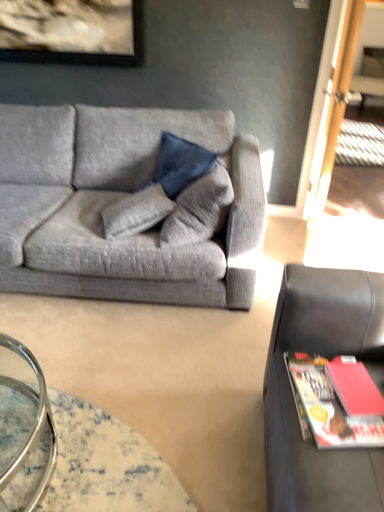
Question: From a real-world perspective, is red matte magazine at right below textured gray couch at left, the first studio couch positioned from the left?

Choices:
 (A) yes
 (B) no

Answer: (B)

Question: Can you confirm if red matte magazine at right is bigger than textured gray couch at left, the 1th studio couch when ordered from back to front?

Choices:
 (A) yes
 (B) no

Answer: (B)

Question: Can you confirm if red matte magazine at right is thinner than textured gray couch at left, the first studio couch positioned from the left?

Choices:
 (A) no
 (B) yes

Answer: (B)

Question: Does red matte magazine at right have a greater width compared to textured gray couch at left, which is counted as the second studio couch, starting from the right?

Choices:
 (A) no
 (B) yes

Answer: (A)

Question: Does red matte magazine at right appear on the left side of textured gray couch at left, which is counted as the second studio couch, starting from the right?

Choices:
 (A) yes
 (B) no

Answer: (B)

Question: Is red matte magazine at right directly adjacent to textured gray couch at left, which is counted as the second studio couch, starting from the right?

Choices:
 (A) yes
 (B) no

Answer: (B)

Question: From a real-world perspective, is textured gray couch at left, the 2th studio couch when ordered from front to back, positioned under matte red book at lower right based on gravity?

Choices:
 (A) yes
 (B) no

Answer: (A)

Question: Is the position of textured gray couch at left, the 2th studio couch when ordered from front to back, more distant than that of matte red book at lower right?

Choices:
 (A) yes
 (B) no

Answer: (A)

Question: Is textured gray couch at left, the first studio couch positioned from the left, touching matte red book at lower right?

Choices:
 (A) no
 (B) yes

Answer: (A)

Question: From the image's perspective, is textured gray couch at left, which is counted as the second studio couch, starting from the right, under matte red book at lower right?

Choices:
 (A) yes
 (B) no

Answer: (B)

Question: Considering the relative sizes of textured gray couch at left, the 2th studio couch when ordered from front to back, and matte red book at lower right in the image provided, is textured gray couch at left, the 2th studio couch when ordered from front to back, taller than matte red book at lower right?

Choices:
 (A) yes
 (B) no

Answer: (A)

Question: Is textured gray couch at left, the first studio couch positioned from the left, bigger than matte red book at lower right?

Choices:
 (A) yes
 (B) no

Answer: (A)

Question: From the image's perspective, is matte red book at lower right located beneath black leather studio couch at right, which ranks as the 1th studio couch in right-to-left order?

Choices:
 (A) no
 (B) yes

Answer: (A)